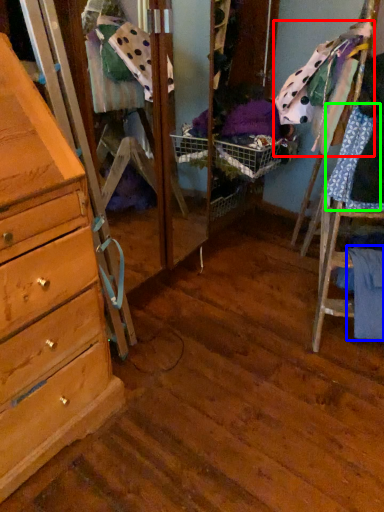
Question: Based on their relative distances, which object is farther from clothing (highlighted by a red box)? Choose from clothing (highlighted by a blue box) and clothing (highlighted by a green box).

Choices:
 (A) clothing
 (B) clothing

Answer: (A)